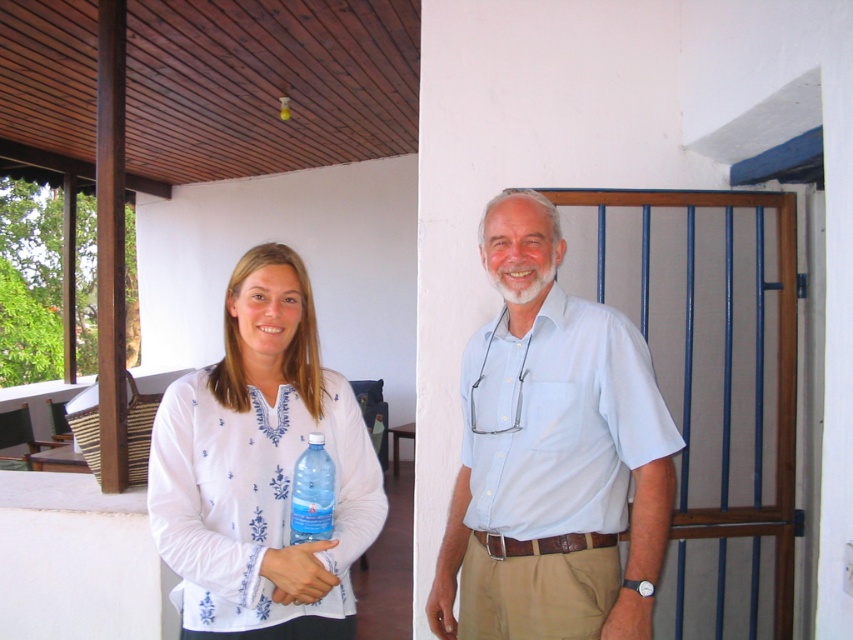
You are standing in the room and want to reach the point at coordinates point (265, 592). If your reach is 1.5 meters, can you touch it without moving your feet?

The point (265, 592) is 1.49 meters from the camera, so yes, you can touch it without moving your feet since your reach is 1.5 meters.

Based on the scene description, where is the light blue cotton shirt at center located in terms of its 2D coordinates?

The light blue cotton shirt at center is located at the 2D coordinates point (552,456).

You are a photographer standing 20 inches away from the two people in the image. You want to take a photo of the light blue cotton shirt at center without including the transparent plastic bottle at center in the frame. Is this possible based on their positions?

The light blue cotton shirt at center is 19.09 inches away from the transparent plastic bottle at center. Since you are standing 20 inches away from them, you can position your camera slightly to avoid the transparent plastic bottle at center while focusing on the light blue cotton shirt at center as the distance between them allows for such adjustment.